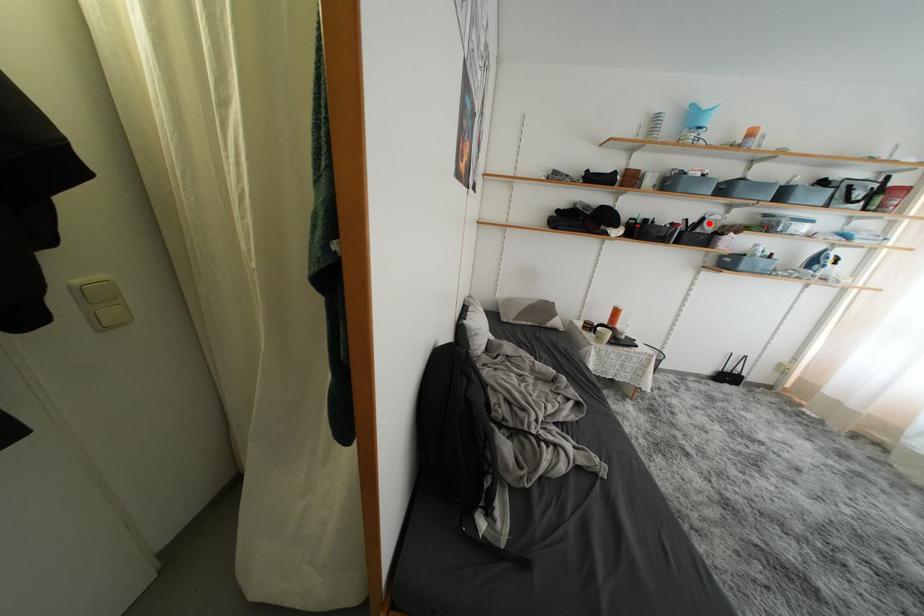
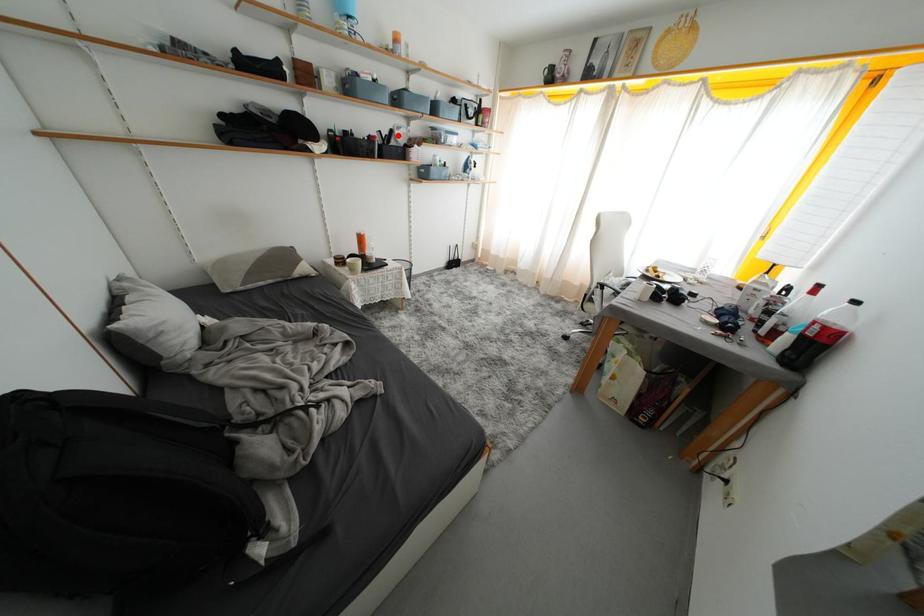
I am providing you with two images of the same scene from different viewpoints. A red point is marked on the first image and another point is marked on the second image. Is the marked point in image1 the same physical position as the marked point in image2?

→ Yes